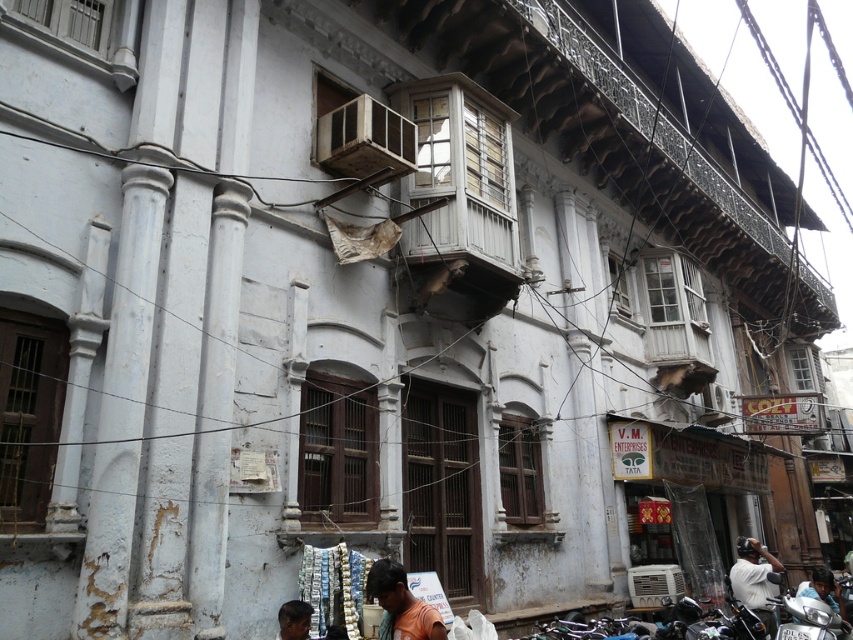
Does orange cotton shirt at lower center appear on the left side of silver metallic motorcycle at lower right?

Indeed, orange cotton shirt at lower center is positioned on the left side of silver metallic motorcycle at lower right.

Which is above, orange cotton shirt at lower center or silver metallic motorcycle at lower right?

orange cotton shirt at lower center

This screenshot has width=853, height=640. Describe the element at coordinates (401, 604) in the screenshot. I see `orange cotton shirt at lower center` at that location.

Locate an element on the screen. The image size is (853, 640). orange cotton shirt at lower center is located at coordinates (401, 604).

Is point (737, 540) positioned in front of point (828, 572)?

No, (737, 540) is behind (828, 572).

Does point (730, 582) come farther from viewer compared to point (833, 589)?

That is True.

Which is behind, point (753, 566) or point (817, 577)?

Positioned behind is point (753, 566).

The width and height of the screenshot is (853, 640). Identify the location of dark gray shirt at lower right. (753, 579).

Does silver metallic motorcycle at lower right have a smaller size compared to dark brown skin at lower center?

No.

Can you confirm if silver metallic motorcycle at lower right is shorter than dark brown skin at lower center?

In fact, silver metallic motorcycle at lower right may be taller than dark brown skin at lower center.

The height and width of the screenshot is (640, 853). I want to click on silver metallic motorcycle at lower right, so click(810, 618).